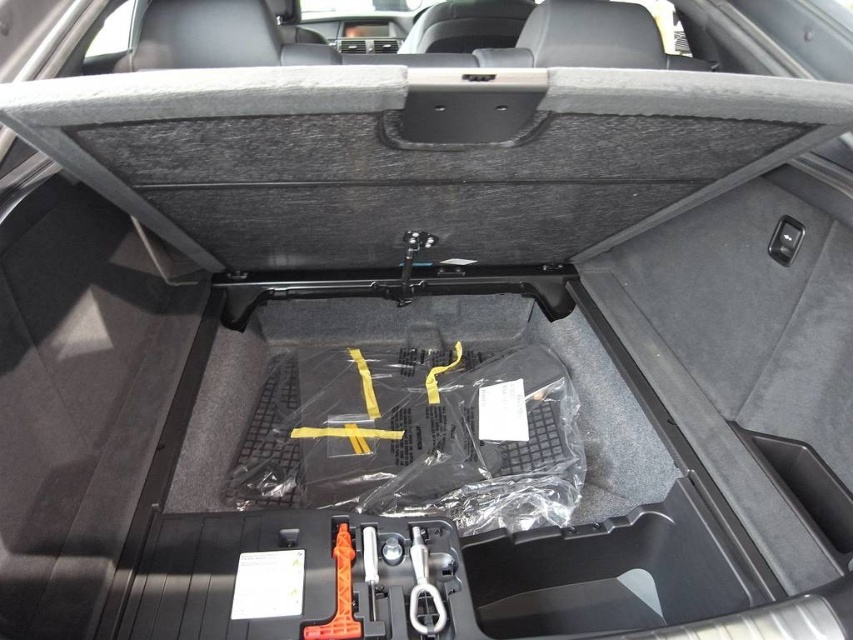
Question: Among these points, which one is farthest from the camera?

Choices:
 (A) (349, 588)
 (B) (415, 538)
 (C) (373, 577)

Answer: (B)

Question: Which object appears farthest from the camera in this image?

Choices:
 (A) metallic silver wrench at center
 (B) white plastic tool at center

Answer: (B)

Question: Is orange plastic tool at lower center in front of white plastic tool at center?

Choices:
 (A) no
 (B) yes

Answer: (B)

Question: Which of the following is the closest to the observer?

Choices:
 (A) 416,532
 (B) 346,536

Answer: (B)

Question: Can you confirm if orange plastic tool at lower center is wider than white plastic tool at center?

Choices:
 (A) yes
 (B) no

Answer: (A)

Question: Is orange plastic tool at lower center to the left of metallic silver wrench at center from the viewer's perspective?

Choices:
 (A) no
 (B) yes

Answer: (B)